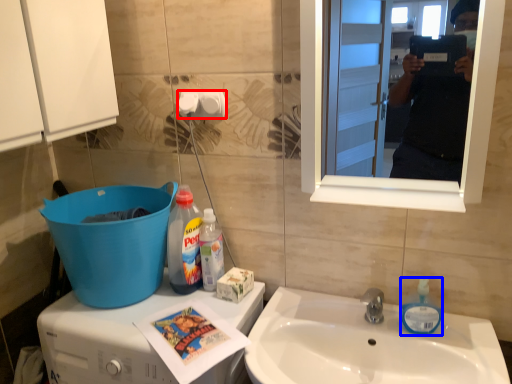
Question: Which object is further to the camera taking this photo, toilet paper (highlighted by a red box) or toiletries (highlighted by a blue box)?

Choices:
 (A) toilet paper
 (B) toiletries

Answer: (A)